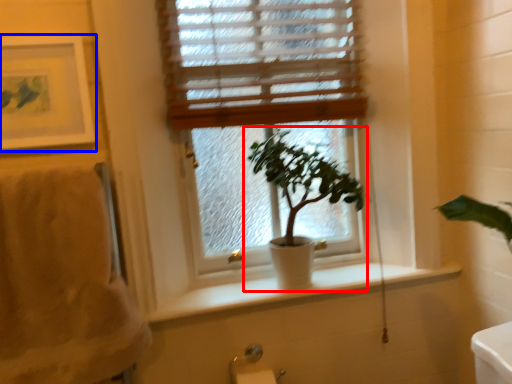
Question: Among these objects, which one is farthest to the camera, houseplant (highlighted by a red box) or picture frame (highlighted by a blue box)?

Choices:
 (A) houseplant
 (B) picture frame

Answer: (A)